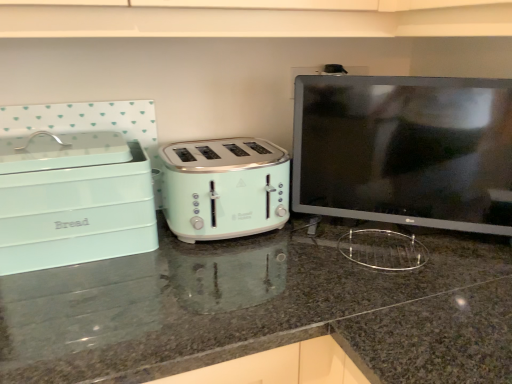
Question: Does mint green plastic toaster at center lie in front of matte black monitor at right?

Choices:
 (A) no
 (B) yes

Answer: (A)

Question: Is mint green plastic toaster at center aimed at matte black monitor at right?

Choices:
 (A) no
 (B) yes

Answer: (A)

Question: Is mint green plastic toaster at center outside matte black monitor at right?

Choices:
 (A) no
 (B) yes

Answer: (B)

Question: Does mint green plastic toaster at center appear on the right side of matte black monitor at right?

Choices:
 (A) yes
 (B) no

Answer: (B)

Question: Is mint green plastic toaster at center smaller than matte black monitor at right?

Choices:
 (A) no
 (B) yes

Answer: (B)

Question: From a real-world perspective, relative to matte black monitor at right, is mint green plastic toaster at center vertically above or below?

Choices:
 (A) above
 (B) below

Answer: (B)

Question: Is mint green plastic toaster at center spatially inside matte black monitor at right, or outside of it?

Choices:
 (A) outside
 (B) inside

Answer: (A)

Question: Is point (200, 203) positioned closer to the camera than point (433, 157)?

Choices:
 (A) closer
 (B) farther

Answer: (A)

Question: Is mint green plastic toaster at center wider or thinner than matte black monitor at right?

Choices:
 (A) thin
 (B) wide

Answer: (B)

Question: Considering the positions of point (126, 165) and point (456, 210), is point (126, 165) closer or farther from the camera than point (456, 210)?

Choices:
 (A) farther
 (B) closer

Answer: (B)

Question: In the image, is mint green plastic bread bin at left positioned in front of or behind matte black monitor at right?

Choices:
 (A) behind
 (B) front

Answer: (B)

Question: Is mint green plastic bread bin at left to the left or to the right of matte black monitor at right in the image?

Choices:
 (A) right
 (B) left

Answer: (B)

Question: From the image's perspective, is mint green plastic bread bin at left located above or below matte black monitor at right?

Choices:
 (A) below
 (B) above

Answer: (A)

Question: From the image's perspective, relative to matte green toaster at center, is mint green plastic bread bin at left above or below?

Choices:
 (A) below
 (B) above

Answer: (B)

Question: Looking at the image, does mint green plastic bread bin at left seem bigger or smaller compared to matte green toaster at center?

Choices:
 (A) small
 (B) big

Answer: (A)